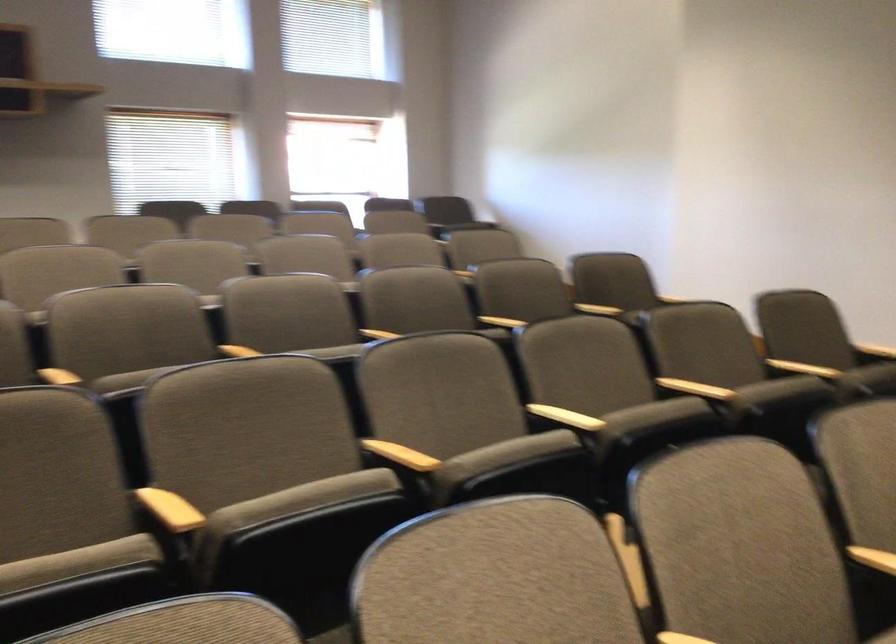
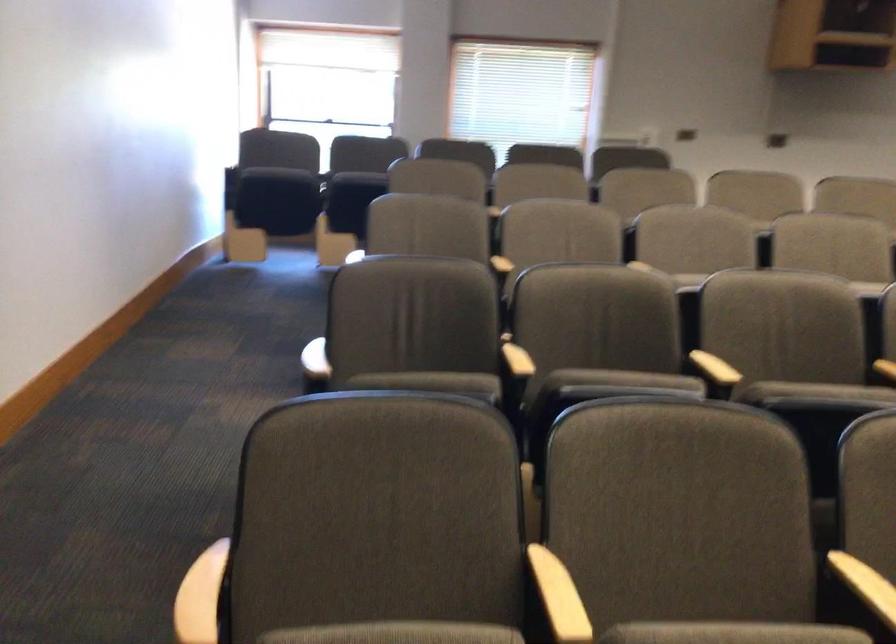
The images are taken continuously from a first-person perspective. In which direction is your viewpoint rotating?

The rotation direction of the camera is right-down.